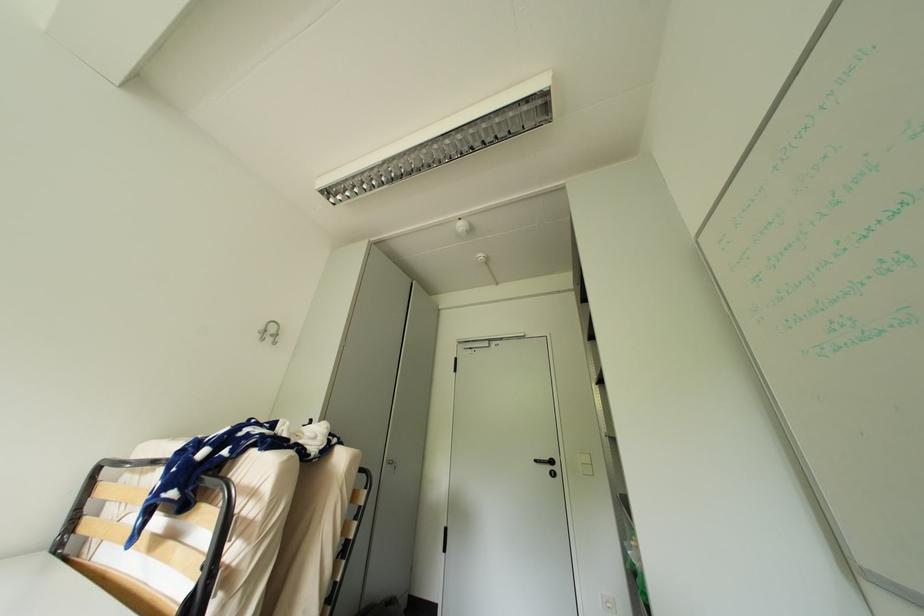
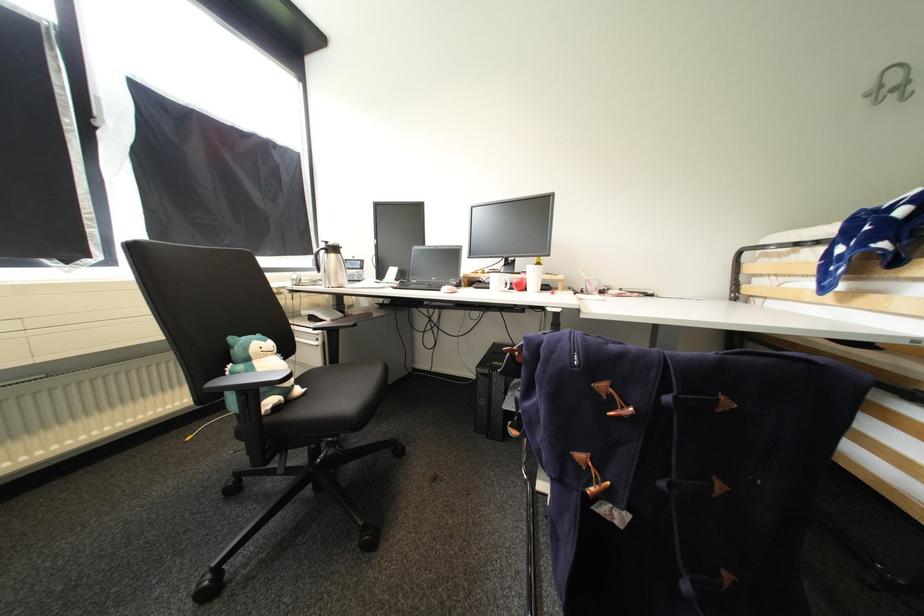
Question: The camera is either moving clockwise (left) or counter-clockwise (right) around the object. The first image is from the beginning of the video and the second image is from the end. Is the camera moving left or right when shooting the video?

Choices:
 (A) Left
 (B) Right

Answer: (B)